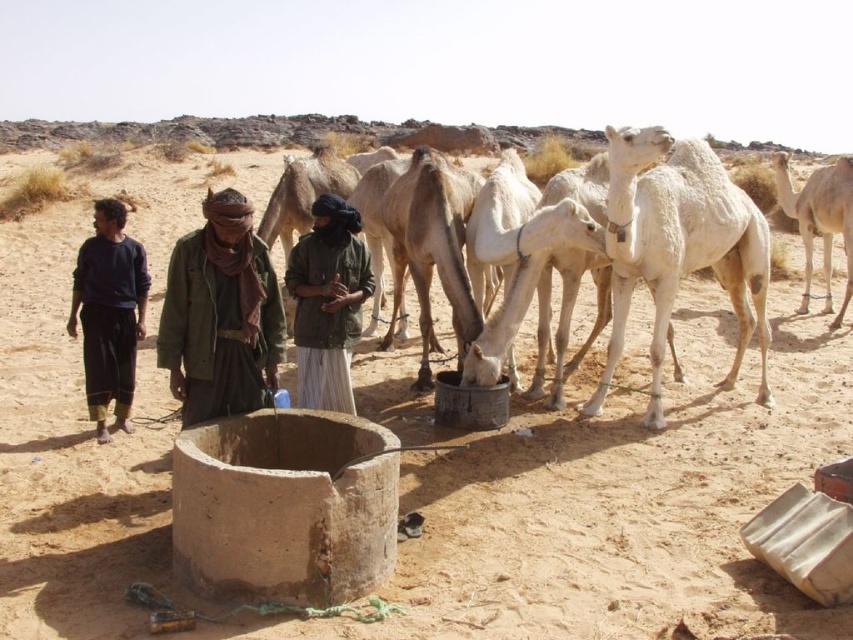
Who is higher up, brown fabric headscarf at center or white matte camel at right?

white matte camel at right is higher up.

Does brown fabric headscarf at center have a larger size compared to white matte camel at right?

No, brown fabric headscarf at center is not bigger than white matte camel at right.

Is point (259, 321) farther from camera compared to point (801, 189)?

No, it is not.

Where is `brown fabric headscarf at center`? The height and width of the screenshot is (640, 853). brown fabric headscarf at center is located at coordinates (219, 314).

Who is higher up, green fabric headscarf at center or dark blue fabric pants at left?

green fabric headscarf at center is above.

Can you confirm if green fabric headscarf at center is positioned to the right of dark blue fabric pants at left?

Yes, green fabric headscarf at center is to the right of dark blue fabric pants at left.

The height and width of the screenshot is (640, 853). In order to click on green fabric headscarf at center in this screenshot , I will do `click(328, 301)`.

Where is `green fabric headscarf at center`? Image resolution: width=853 pixels, height=640 pixels. green fabric headscarf at center is located at coordinates (328, 301).

The width and height of the screenshot is (853, 640). Describe the element at coordinates (328, 301) in the screenshot. I see `green fabric headscarf at center` at that location.

Who is more distant from viewer, [316,400] or [811,256]?

Point [811,256]

The height and width of the screenshot is (640, 853). Find the location of `green fabric headscarf at center`. green fabric headscarf at center is located at coordinates (328, 301).